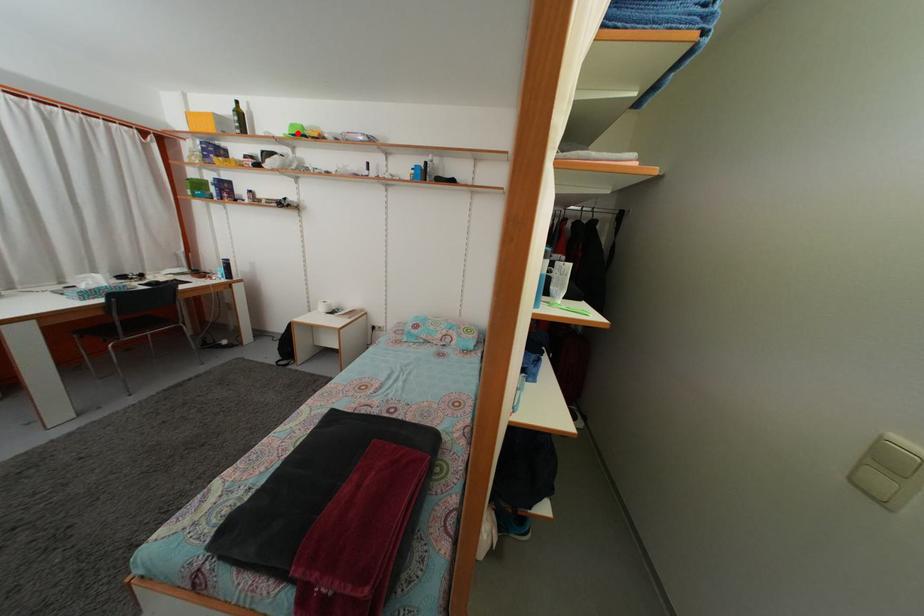
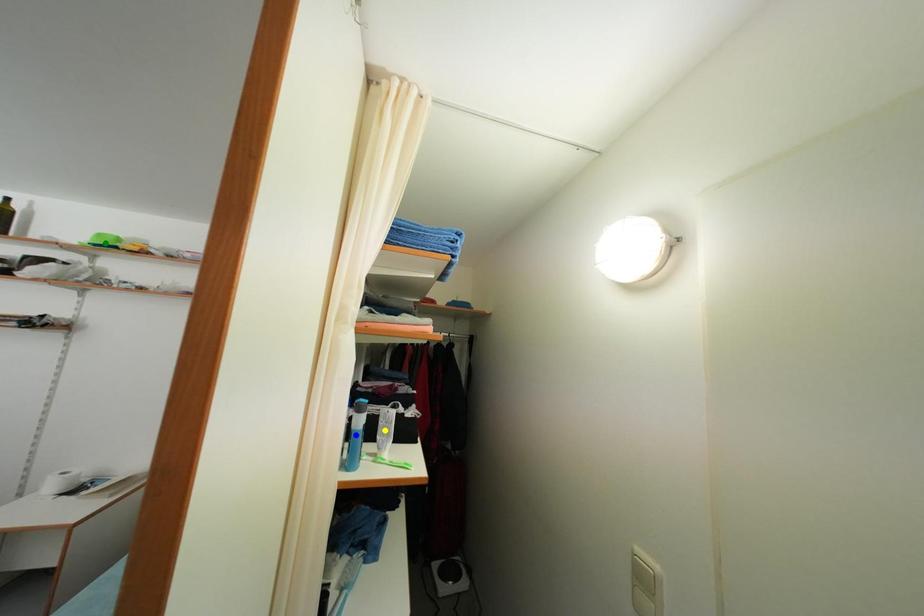
Question: I am providing you with two images of the same scene from different viewpoints. A red point is marked on the first image. You are given multiple points on the second image. Which mark in image 2 goes with the point in image 1?

Choices:
 (A) yellow point
 (B) green point
 (C) blue point

Answer: (B)